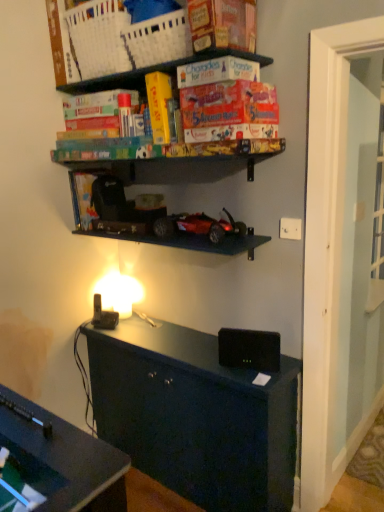
Question: From a real-world perspective, is orange matte board game at upper center over shiny red plastic toy car at center?

Choices:
 (A) yes
 (B) no

Answer: (A)

Question: Is orange matte board game at upper center positioned behind shiny red plastic toy car at center?

Choices:
 (A) yes
 (B) no

Answer: (B)

Question: Is orange matte board game at upper center oriented towards shiny red plastic toy car at center?

Choices:
 (A) no
 (B) yes

Answer: (A)

Question: Is the surface of orange matte board game at upper center in direct contact with shiny red plastic toy car at center?

Choices:
 (A) no
 (B) yes

Answer: (A)

Question: From the image's perspective, does orange matte board game at upper center appear higher than shiny red plastic toy car at center?

Choices:
 (A) no
 (B) yes

Answer: (B)

Question: From their relative heights in the image, would you say shiny red plastic toy car at center is taller or shorter than black matte speaker at center?

Choices:
 (A) short
 (B) tall

Answer: (A)

Question: Considering the positions of point (195, 233) and point (264, 348), is point (195, 233) closer or farther from the camera than point (264, 348)?

Choices:
 (A) closer
 (B) farther

Answer: (B)

Question: Is shiny red plastic toy car at center wider or thinner than black matte speaker at center?

Choices:
 (A) thin
 (B) wide

Answer: (B)

Question: Is shiny red plastic toy car at center to the left or to the right of black matte speaker at center in the image?

Choices:
 (A) right
 (B) left

Answer: (B)

Question: Looking at their shapes, would you say orange matte board game at upper center is wider or thinner than black matte speaker at center?

Choices:
 (A) thin
 (B) wide

Answer: (B)

Question: From their relative heights in the image, would you say orange matte board game at upper center is taller or shorter than black matte speaker at center?

Choices:
 (A) tall
 (B) short

Answer: (A)

Question: Choose the correct answer: Is orange matte board game at upper center inside black matte speaker at center or outside it?

Choices:
 (A) inside
 (B) outside

Answer: (B)

Question: From the image's perspective, relative to black matte speaker at center, is orange matte board game at upper center above or below?

Choices:
 (A) above
 (B) below

Answer: (A)

Question: Considering the positions of shiny red plastic toy car at center and white plastic electric outlet at upper right in the image, is shiny red plastic toy car at center taller or shorter than white plastic electric outlet at upper right?

Choices:
 (A) tall
 (B) short

Answer: (A)

Question: Is shiny red plastic toy car at center wider or thinner than white plastic electric outlet at upper right?

Choices:
 (A) wide
 (B) thin

Answer: (A)